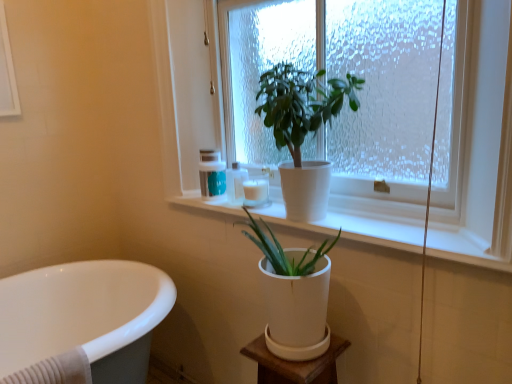
Question: From the image's perspective, relative to matte white container at upper center, which is the 1th toiletry in left-to-right order, is white matte pot at center, the first houseplant when ordered from bottom to top, above or below?

Choices:
 (A) below
 (B) above

Answer: (A)

Question: Relative to matte white container at upper center, which is the 1th toiletry in left-to-right order, is white matte pot at center, the second houseplant from the top, in front or behind?

Choices:
 (A) front
 (B) behind

Answer: (A)

Question: Which object is the farthest from the white matte candle at center, the third toiletry from the left?

Choices:
 (A) white matte pot at center, the second houseplant from the top
 (B) white glossy bathtub at lower left
 (C) matte white container at upper center, which is counted as the third toiletry, starting from the right
 (D) white matte plant pot at upper center
 (E) white matte window sill at upper center

Answer: (B)

Question: Which of these objects is positioned closest to the green matte plant at upper center, acting as the 1th houseplant starting from the top?

Choices:
 (A) matte white bottle at upper center, the 2th toiletry positioned from the right
 (B) white matte window sill at upper center
 (C) white matte pot at lower center
 (D) white glossy bathtub at lower left
 (E) matte white container at upper center, which is counted as the third toiletry, starting from the right

Answer: (B)